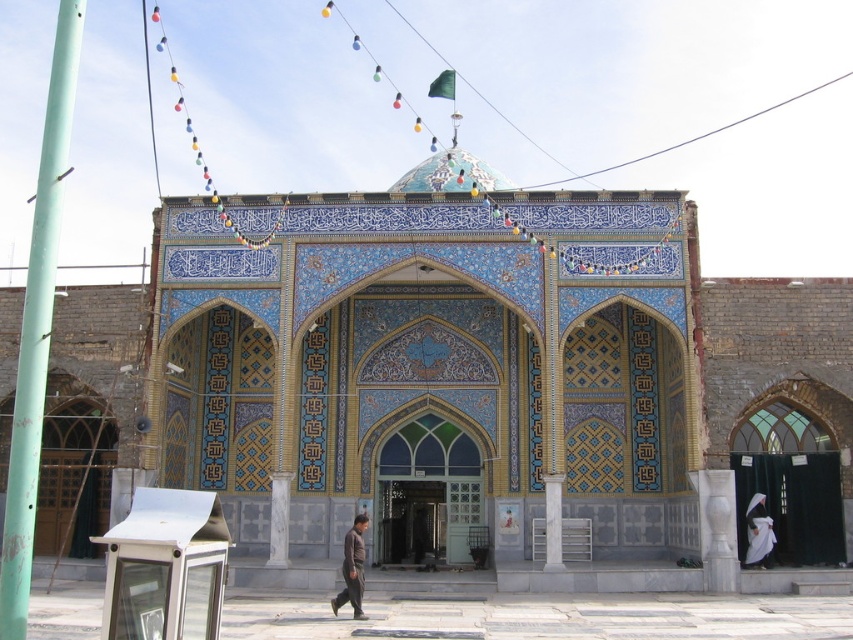
You are standing in front of the mosque and notice the green painted metal pole at left and the dark brown fabric at center. From your perspective, which object is positioned more to the left?

The green painted metal pole at left is positioned more to the left than the dark brown fabric at center.

Looking at this image, you are standing in front of the mosque and want to place a small decorative item between the green painted metal pole at left and the white fabric at right. Considering their sizes, which object should the item be placed closer to?

The green painted metal pole at left is larger than the white fabric at right, so the small decorative item should be placed closer to the white fabric at right to maintain balance.